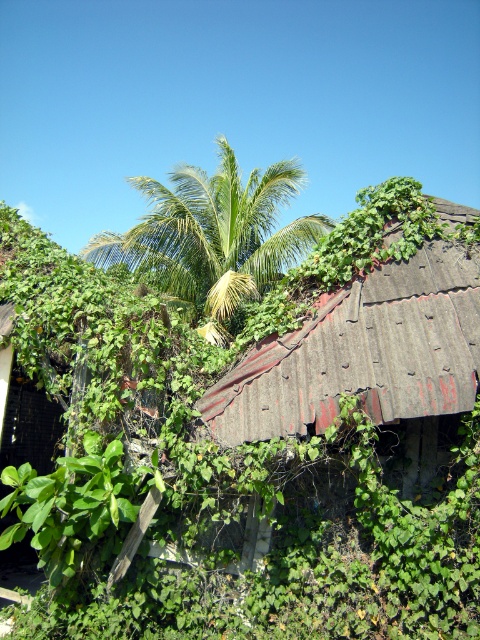
You are a painter who needs to decide whether to paint the rusty corrugated metal roof at center or the green leafy palm tree at center first. Since you have limited time, you want to choose the narrower object to paint first. Which one should you choose?

The rusty corrugated metal roof at center is narrower than the green leafy palm tree at center, so you should paint the rusty corrugated metal roof at center first.

You are standing in front of the structure and want to determine which object is taller. Based on the scene, which one is taller between the rusty corrugated metal roof at center and the green leafy palm tree at center?

The green leafy palm tree at center is taller than the rusty corrugated metal roof at center.

You are a bird looking for a place to perch. You see the rusty corrugated metal roof at center and the green leafy palm tree at center. Which one is higher up in the air?

The green leafy palm tree at center is higher up in the air than the rusty corrugated metal roof at center because the roof is positioned under the tree.